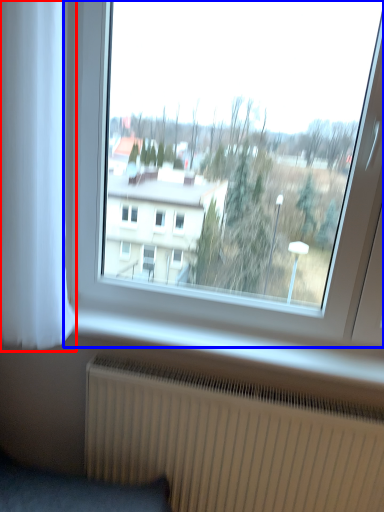
Question: Which object appears farthest to the camera in this image, curtain (highlighted by a red box) or window (highlighted by a blue box)?

Choices:
 (A) curtain
 (B) window

Answer: (B)